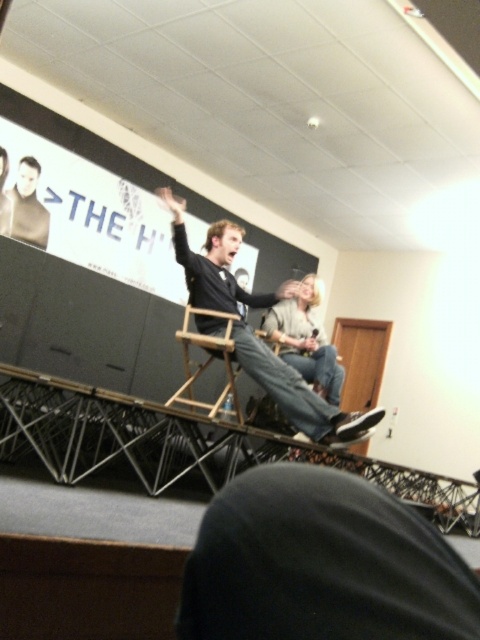
Question: In this image, where is matte black shirt at left located relative to smooth black shirt at upper center?

Choices:
 (A) left
 (B) right

Answer: (B)

Question: Among these points, which one is nearest to the camera?

Choices:
 (A) (48, 113)
 (B) (297, 364)

Answer: (B)

Question: Which object is the closest to the white matte projection screen at upper center?

Choices:
 (A) light gray sweater at center
 (B) matte black shirt at left
 (C) wooden director's chair at center

Answer: (B)

Question: Which of the following is the farthest from the observer?

Choices:
 (A) (264, 296)
 (B) (7, 227)
 (C) (276, 310)

Answer: (B)

Question: Is wooden director's chair at center positioned at the back of matte black shirt at left?

Choices:
 (A) no
 (B) yes

Answer: (A)

Question: Is wooden director's chair at center bigger than smooth black shirt at upper center?

Choices:
 (A) yes
 (B) no

Answer: (A)